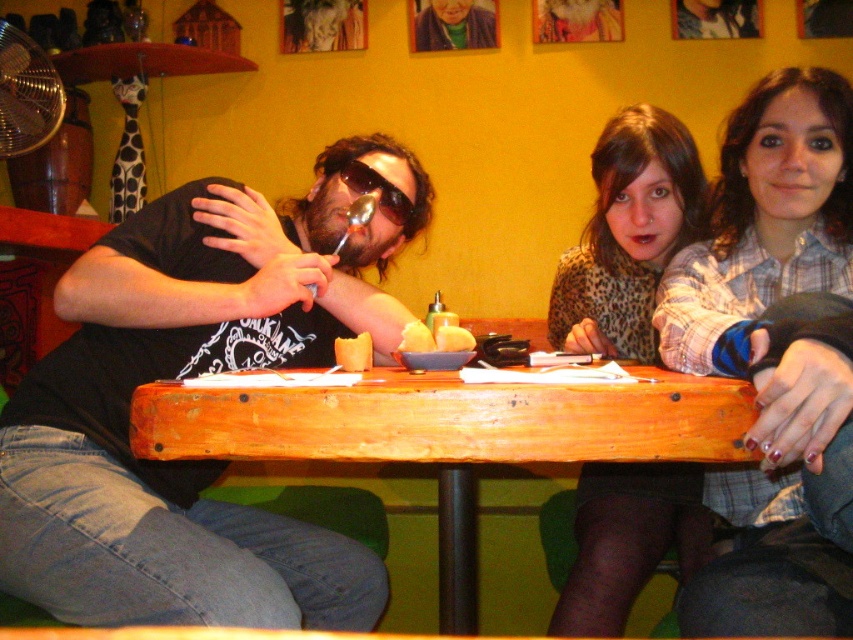
Which is in front, point (392, 192) or point (337, 340)?

Positioned in front is point (337, 340).

Does sunglasses at center lie behind orange matte cupcake at center?

That is True.

You are a GUI agent. You are given a task and a screenshot of the screen. Output one action in this format:
    pyautogui.click(x=<x>, y=<y>)
    Task: Click on the sunglasses at center
    The image size is (853, 640).
    Given the screenshot: What is the action you would take?
    pyautogui.click(x=373, y=195)

The image size is (853, 640). Find the location of `sunglasses at center`. sunglasses at center is located at coordinates (373, 195).

Can you confirm if black matte shirt at center is shorter than yellow matte butter at center?

No, black matte shirt at center is not shorter than yellow matte butter at center.

Is point (68, 342) behind point (416, 323)?

No, (68, 342) is in front of (416, 323).

Where is `black matte shirt at center`? black matte shirt at center is located at coordinates (183, 378).

Who is more forward, (21, 33) or (334, 356)?

Point (334, 356) is more forward.

Does brushed metal fan at upper left appear over orange matte cupcake at center?

Correct, brushed metal fan at upper left is located above orange matte cupcake at center.

Identify the location of brushed metal fan at upper left. (26, 93).